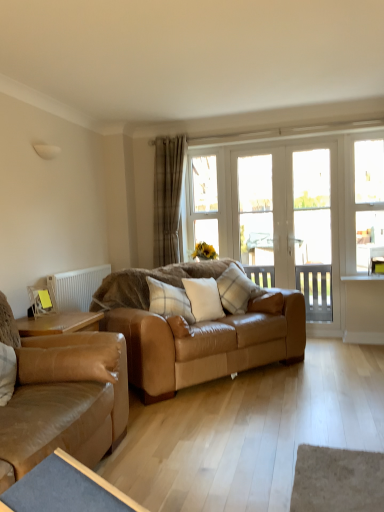
You are a GUI agent. You are given a task and a screenshot of the screen. Output one action in this format:
    pyautogui.click(x=<x>, y=<y>)
    Task: Click on the free space above beige plaid curtain at center (from a real-world perspective)
    The width and height of the screenshot is (384, 512).
    Given the screenshot: What is the action you would take?
    pyautogui.click(x=174, y=134)